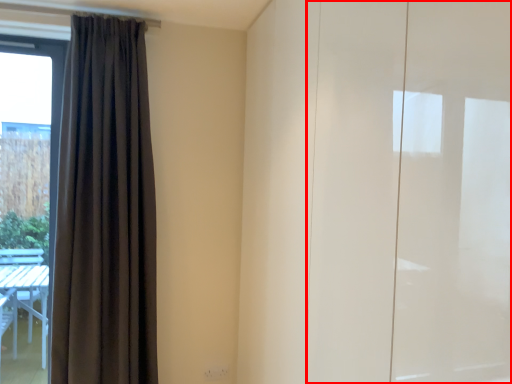
Question: In this image, where is screen door (annotated by the red box) located relative to curtain?

Choices:
 (A) right
 (B) left

Answer: (A)